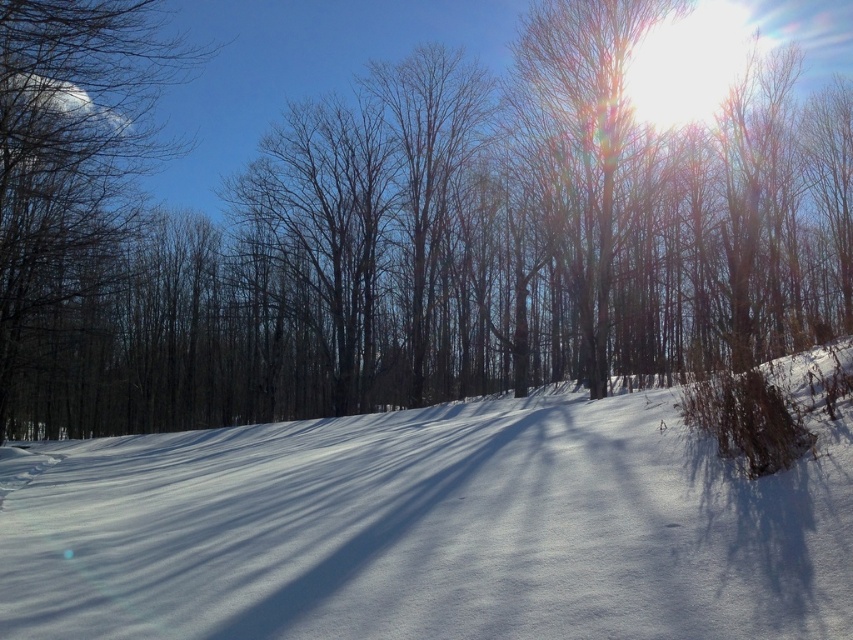
Question: Estimate the real-world distances between objects in this image. Which object is farther from the brown/dry wood at center?

Choices:
 (A) white snow at center
 (B) brown bark tree at left
 (C) smooth bark tree at upper right

Answer: (A)

Question: Is brown bark tree at left positioned before smooth bark tree at upper right?

Choices:
 (A) yes
 (B) no

Answer: (A)

Question: Does brown/dry wood at center have a lesser width compared to brown bark tree at left?

Choices:
 (A) yes
 (B) no

Answer: (B)

Question: Is brown/dry wood at center to the left of brown bark tree at left from the viewer's perspective?

Choices:
 (A) yes
 (B) no

Answer: (B)

Question: Which of the following is the closest to the observer?

Choices:
 (A) (36, 13)
 (B) (692, 515)
 (C) (572, 13)
 (D) (293, 221)

Answer: (B)

Question: Based on their relative distances, which object is nearer to the white snow at center?

Choices:
 (A) smooth bark tree at upper right
 (B) brown/dry wood at center

Answer: (B)